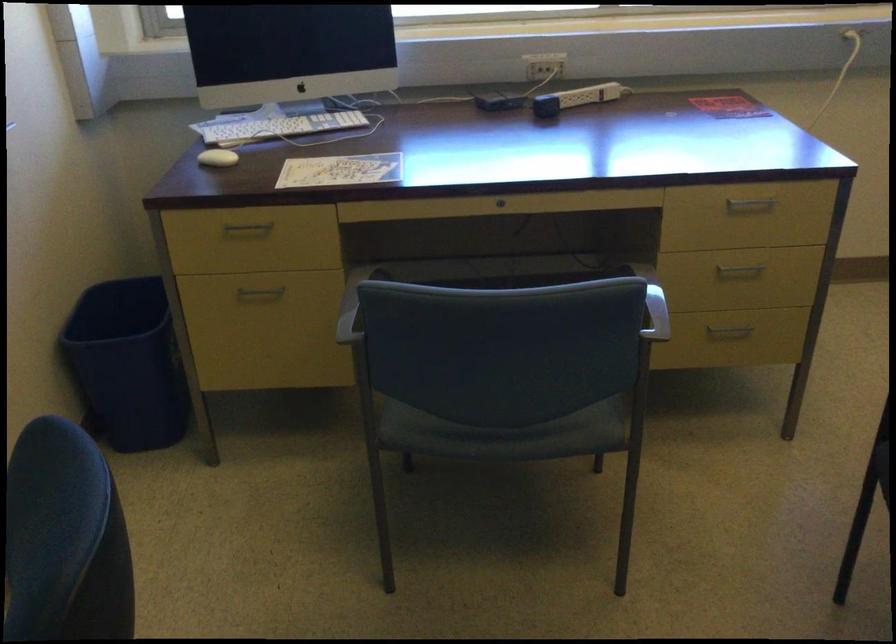
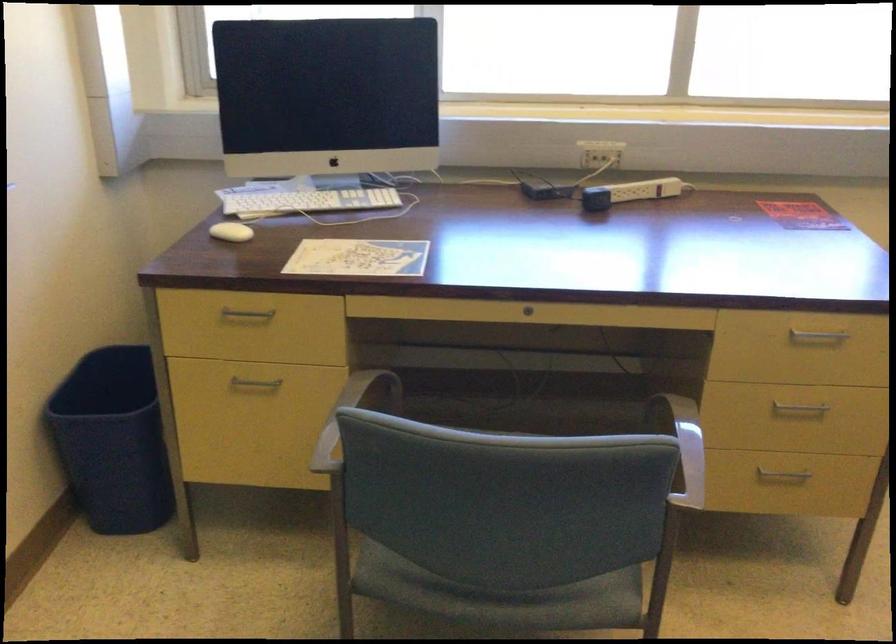
Find the pixel in the second image that matches point 246,228 in the first image.

(247, 313)